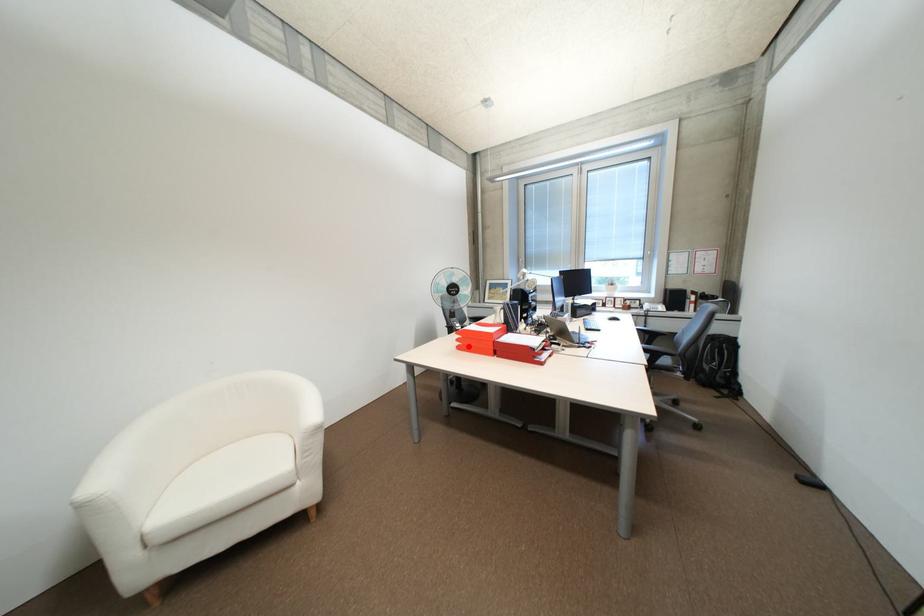
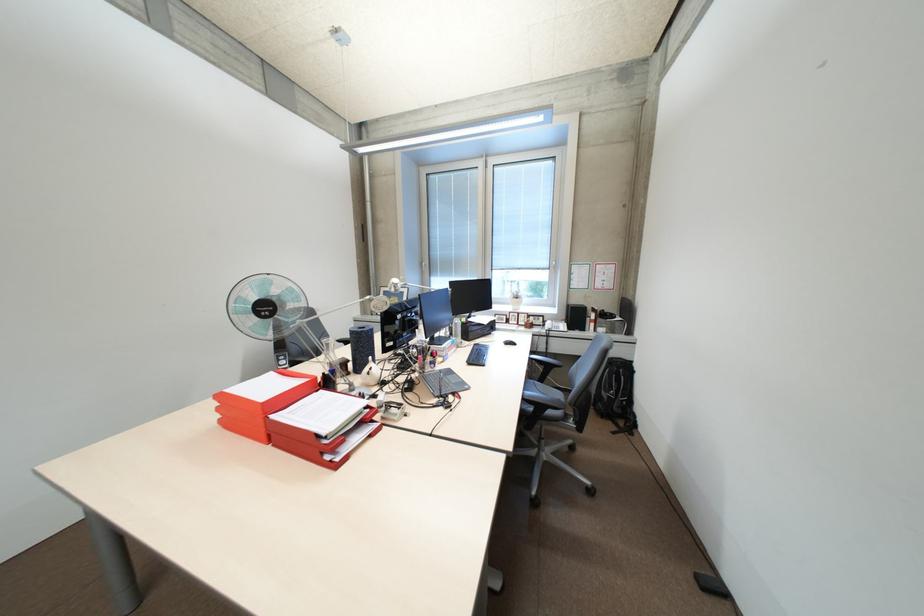
Locate, in the second image, the point that corresponds to the highlighted location in the first image.

(231, 421)